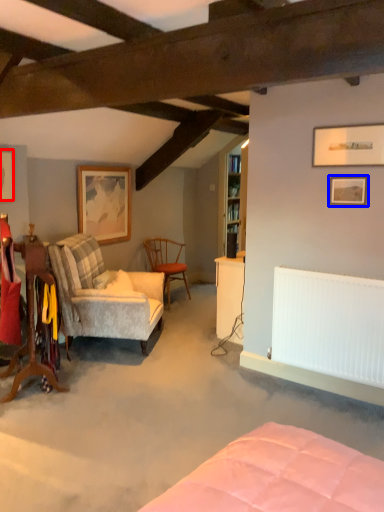
Question: Which object is further to the camera taking this photo, picture frame (highlighted by a red box) or picture frame (highlighted by a blue box)?

Choices:
 (A) picture frame
 (B) picture frame

Answer: (A)